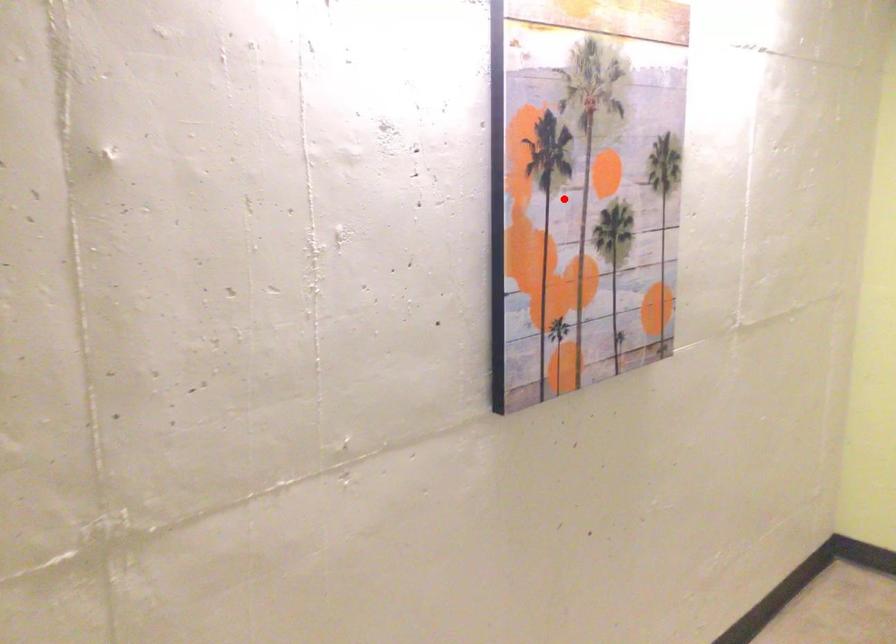
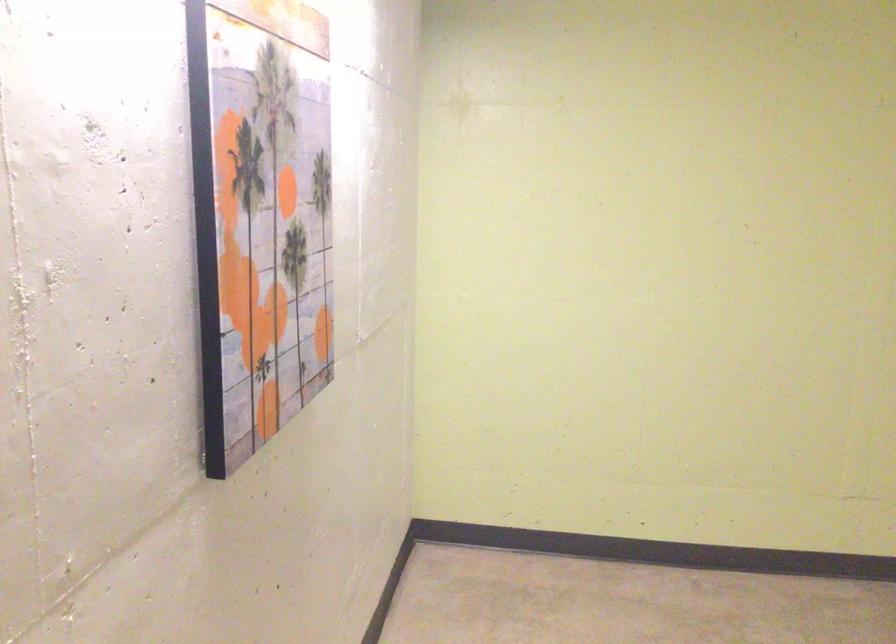
Question: I am providing you with two images of the same scene from different viewpoints. A red point is shown in image1. For the corresponding object point in image2, is it positioned nearer or farther from the camera?

Choices:
 (A) Nearer
 (B) Farther

Answer: (A)